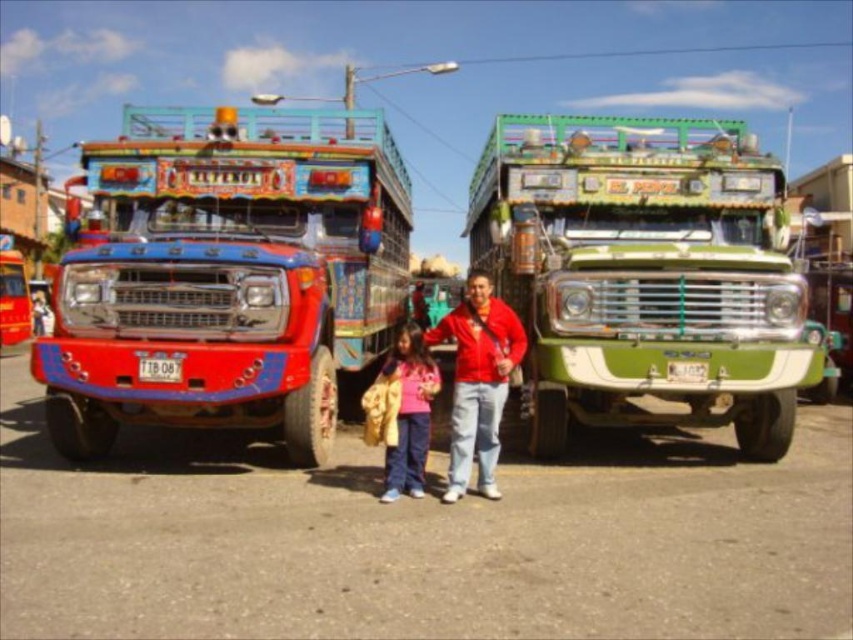
Consider the image. Can you confirm if green matte truck at center is positioned above red matte jacket at center?

Indeed, green matte truck at center is positioned over red matte jacket at center.

Is green matte truck at center smaller than red matte jacket at center?

Actually, green matte truck at center might be larger than red matte jacket at center.

Does point (703, 237) lie behind point (503, 403)?

Yes, it is.

Find the location of `green matte truck at center`. green matte truck at center is located at coordinates (645, 275).

Is point (460, 436) farther from viewer compared to point (422, 438)?

No, it is in front of (422, 438).

Who is more forward, (476, 275) or (409, 381)?

Point (476, 275) is in front.

Identify the location of red matte jacket at center. (479, 380).

Between point (758, 326) and point (418, 339), which one is positioned in front?

Positioned in front is point (418, 339).

Can you confirm if green matte truck at center is smaller than matte pink shirt at center?

Incorrect, green matte truck at center is not smaller in size than matte pink shirt at center.

Between point (679, 154) and point (419, 340), which one is positioned behind?

The point (679, 154) is more distant.

I want to click on green matte truck at center, so 645,275.